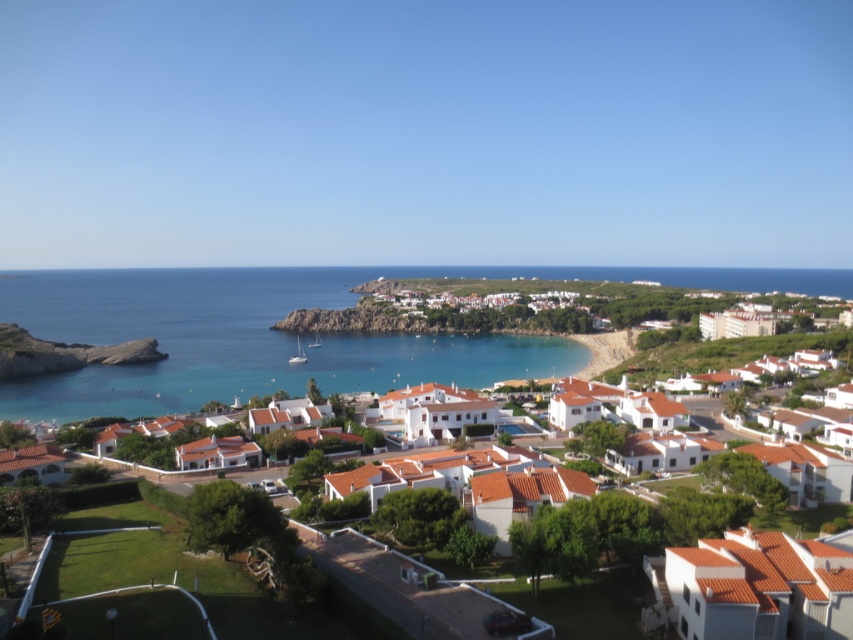
Can you confirm if white matte houses at center is positioned to the left of blue water at center?

Incorrect, white matte houses at center is not on the left side of blue water at center.

Between point (421, 346) and point (132, 282), which one is positioned behind?

The point (132, 282) is more distant.

Identify the location of white matte houses at center. Image resolution: width=853 pixels, height=640 pixels. click(x=236, y=340).